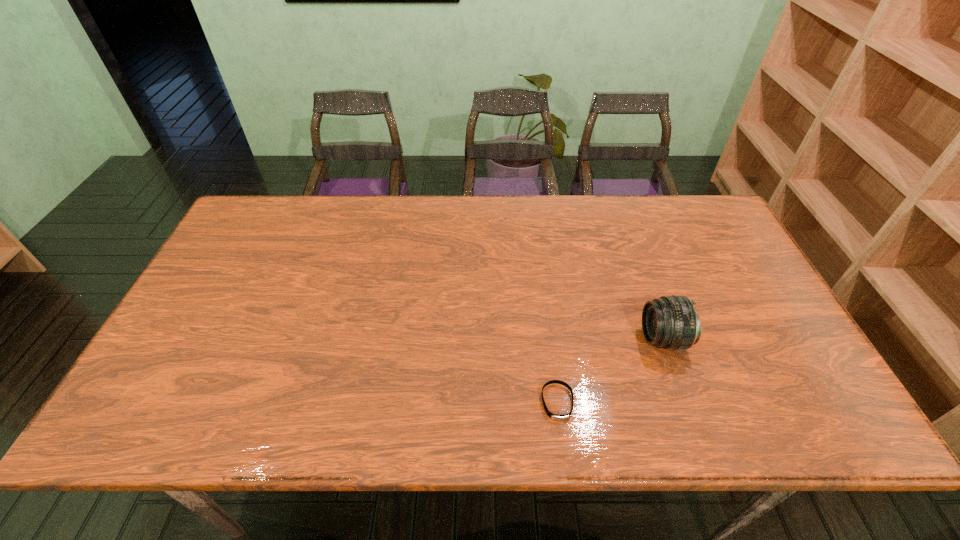
Identify the location of vacant space that satisfies the following two spatial constraints: 1. at the front element of the telephoto lens; 2. on the display of the left object. (685, 402).

Where is `free space that satisfies the following two spatial constraints: 1. at the front element of the right object; 2. on the display of the wristband`? The width and height of the screenshot is (960, 540). free space that satisfies the following two spatial constraints: 1. at the front element of the right object; 2. on the display of the wristband is located at coordinates (685, 402).

At what (x,y) coordinates should I click in order to perform the action: click on free space that satisfies the following two spatial constraints: 1. at the front element of the taller object; 2. on the display of the nearer object. Please return your answer as a coordinate pair (x, y). This screenshot has width=960, height=540. Looking at the image, I should click on (685, 402).

Find the location of `vacant area that satisfies the following two spatial constraints: 1. at the front element of the farther object; 2. on the display of the left object`. vacant area that satisfies the following two spatial constraints: 1. at the front element of the farther object; 2. on the display of the left object is located at coordinates (685, 402).